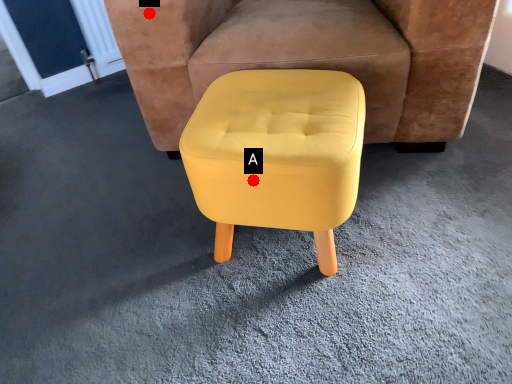
Question: Two points are circled on the image, labeled by A and B beside each circle. Which point appears farthest from the camera in this image?

Choices:
 (A) A is further
 (B) B is further

Answer: (B)